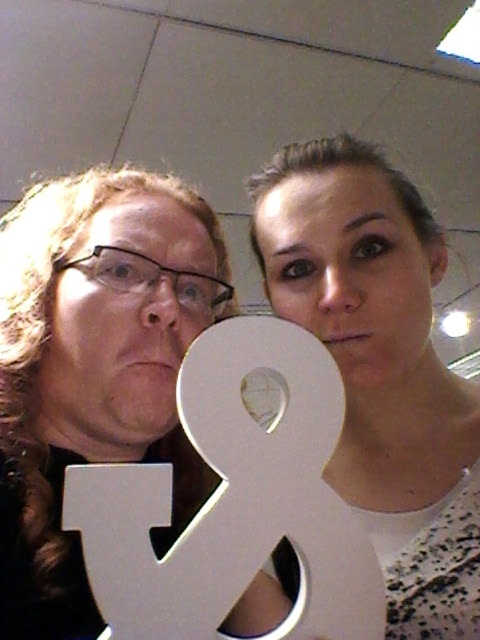
You are a photographer adjusting the focus on your camera. You need to focus on the point closer to the camera between the two points at coordinates point (83, 246) and point (123, 548). Which coordinate should you choose?

Point (83, 246) is further to the camera than point (123, 548), so you should focus on point (83, 246).

You are designing a poster and need to ensure proper layering for visibility. Given the scene with the metallic gold number at center and the white matte letter at center, which object should be placed higher to avoid overlap and maintain clarity?

The metallic gold number at center should be placed higher than the white matte letter at center to avoid overlap and maintain clarity since it is positioned above the white matte letter in the original image.

You are holding a 60 cm long measuring tape and want to reach a point exactly at point (x=132, y=355) in the image. Can you determine if your measuring tape is long enough to reach that point?

The distance of point (x=132, y=355) from viewer is 61.17 centimeters. Since the measuring tape is only 60 cm long, it is not long enough to reach the point.